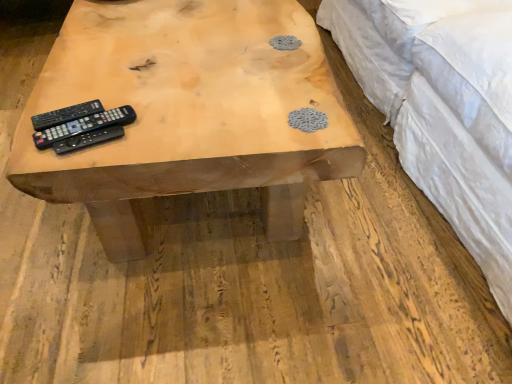
Locate an element on the screen. The width and height of the screenshot is (512, 384). free location above natural wood table at center (from a real-world perspective) is located at coordinates (201, 73).